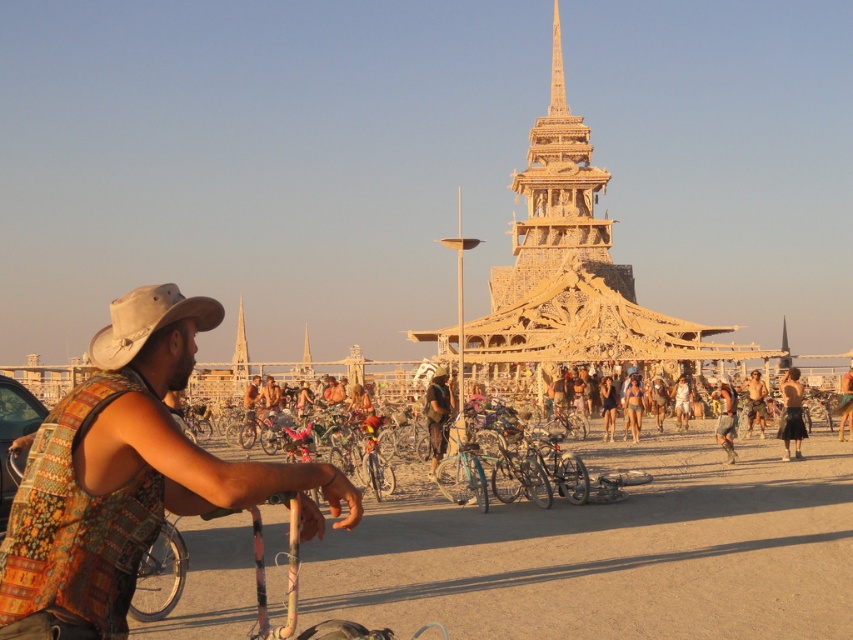
Based on the photo, you are a photographer at the Burning Man festival. You want to take a photo of the black fabric shorts at center without the tan leather cowboy hat at left appearing in the frame. Is this possible based on their positions?

The tan leather cowboy hat at left is in front of the black fabric shorts at center, so it would block the view. To capture the black fabric shorts at center without the hat, you would need to reposition yourself or the subjects to ensure the hat is no longer in front.

You are a photographer at the Burning Man festival. You want to capture both the tan leather cowboy hat at left and the black fabric shorts at center in a single photo. Since the camera can only focus on one object at a time, which object should you focus on to ensure it appears larger in the photo?

The tan leather cowboy hat at left is larger in size than the black fabric shorts at center, so you should focus on the tan leather cowboy hat at left to ensure it appears larger in the photo.

You are standing in the Burning Man festival scene. You see the beige sand at center and the tan leather cowboy hat at left. Which object is positioned lower in the image?

The beige sand at center is located below the tan leather cowboy hat at left, so it is positioned lower in the image.